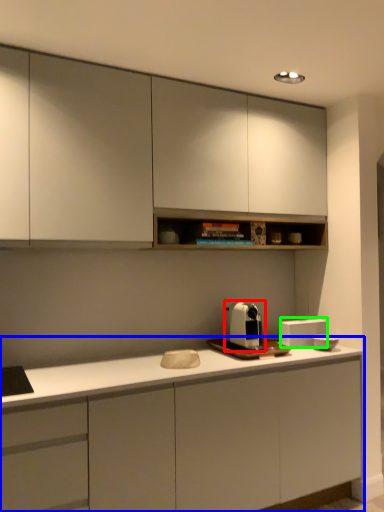
Question: Estimate the real-world distances between objects in this image. Which object is farther from home appliance (highlighted by a red box), cabinetry (highlighted by a blue box) or appliance (highlighted by a green box)?

Choices:
 (A) cabinetry
 (B) appliance

Answer: (A)